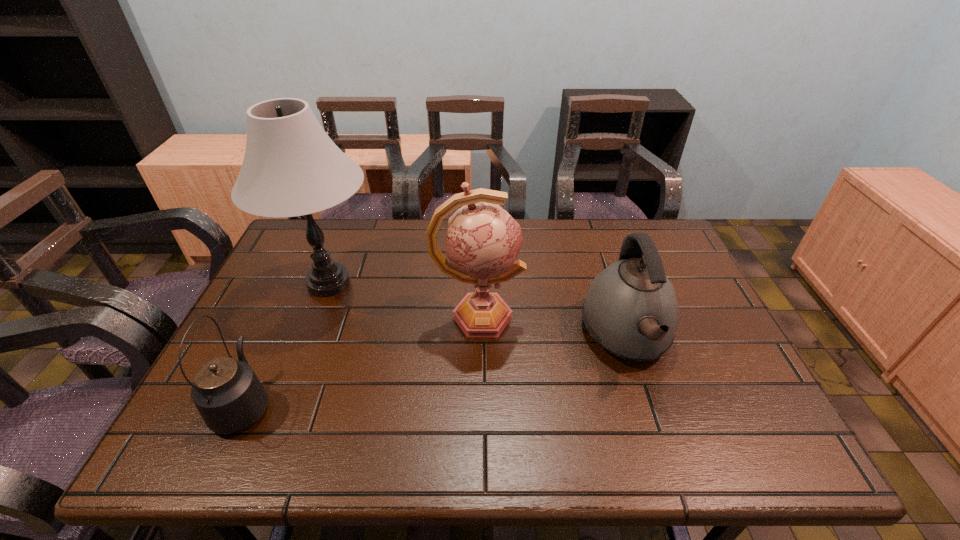
The image size is (960, 540). In the image, there is a desktop. In order to click on free space at the left edge in this screenshot , I will do `click(280, 329)`.

Where is `vacant space at the right edge`? Image resolution: width=960 pixels, height=540 pixels. vacant space at the right edge is located at coordinates (x=702, y=367).

The image size is (960, 540). In the image, there is a desktop. What are the coordinates of `vacant space at the far right corner` in the screenshot? It's located at (661, 229).

Where is `vacant space in between the second object from right to left and the rightmost object`? vacant space in between the second object from right to left and the rightmost object is located at coordinates pos(552,327).

You are a GUI agent. You are given a task and a screenshot of the screen. Output one action in this format:
    pyautogui.click(x=<x>, y=<y>)
    Task: Click on the free space between the right kettle and the left kettle
    
    Given the screenshot: What is the action you would take?
    pyautogui.click(x=436, y=370)

Locate an element on the screen. This screenshot has height=540, width=960. empty space that is in between the third object from left to right and the left kettle is located at coordinates (361, 360).

Locate an element on the screen. vacant space that's between the third object from left to right and the left kettle is located at coordinates (361, 360).

At what (x,y) coordinates should I click in order to perform the action: click on free spot between the second tallest object and the lamp. Please return your answer as a coordinate pair (x, y). Image resolution: width=960 pixels, height=540 pixels. Looking at the image, I should click on tap(403, 300).

You are a GUI agent. You are given a task and a screenshot of the screen. Output one action in this format:
    pyautogui.click(x=<x>, y=<y>)
    Task: Click on the vacant area that lies between the globe and the tallest object
    The image size is (960, 540).
    Given the screenshot: What is the action you would take?
    pyautogui.click(x=403, y=300)

This screenshot has height=540, width=960. In order to click on free space between the third shortest object and the tallest object in this screenshot , I will do `click(403, 300)`.